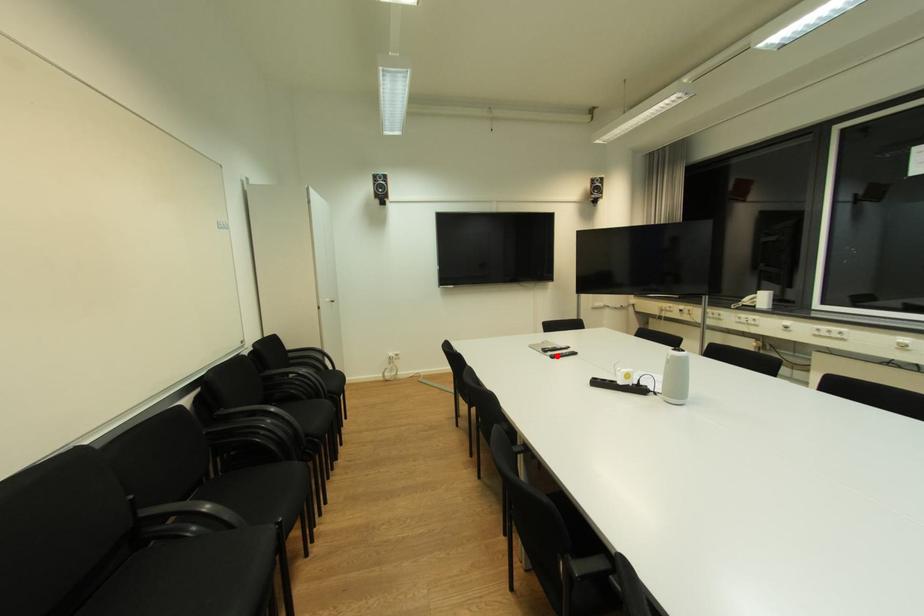
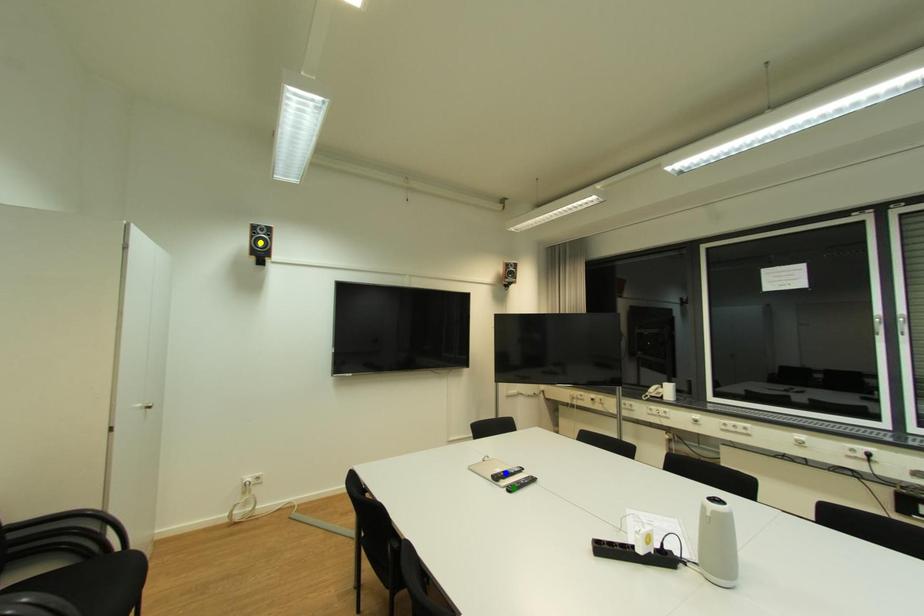
Question: I am providing you with two images of the same scene from different viewpoints. A red point is marked on the first image. You are given multiple points on the second image. Can you choose the point in image 2 that corresponds to the point in image 1?

Choices:
 (A) yellow point
 (B) green point
 (C) blue point

Answer: (B)